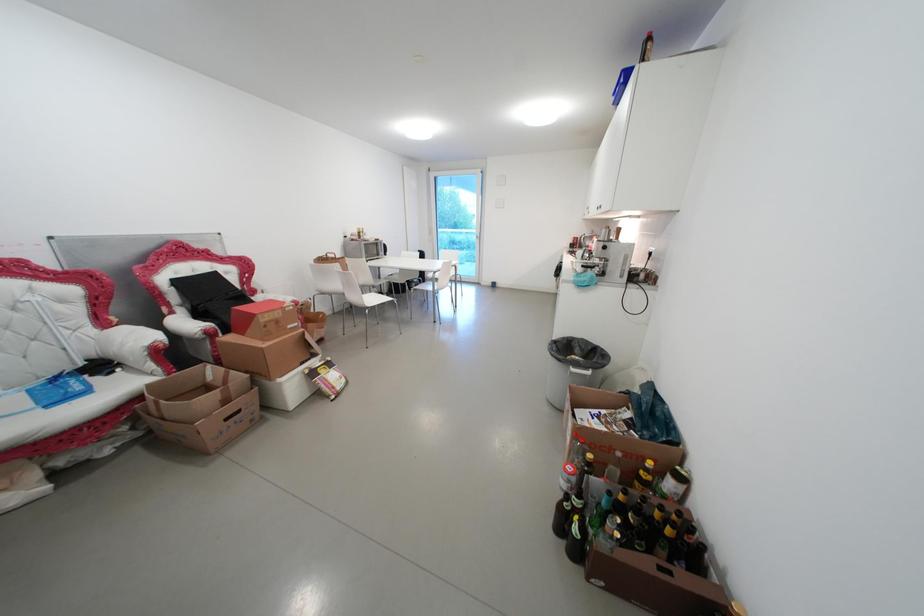
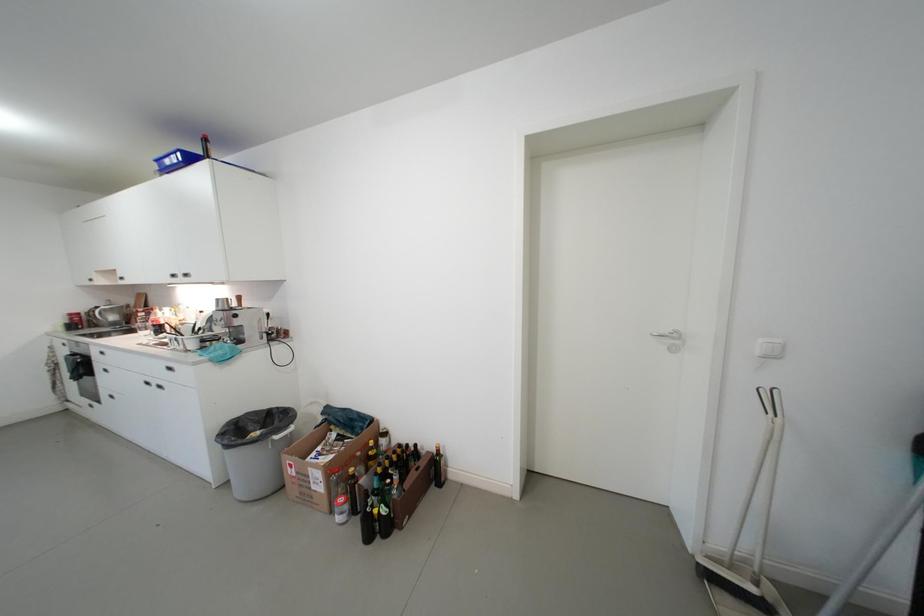
Question: The images are taken continuously from a first-person perspective. In which direction is your viewpoint rotating?

Choices:
 (A) Left
 (B) Right
 (C) Up
 (D) Down

Answer: (B)